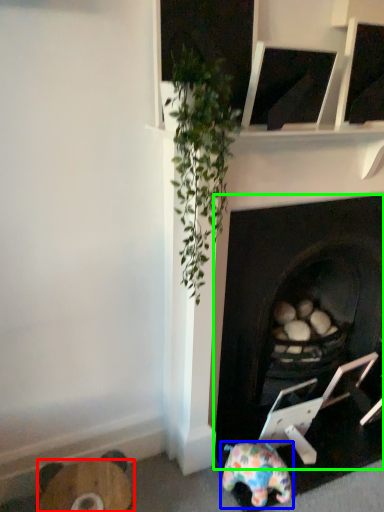
Question: Considering the real-world distances, which object is farthest from furniture (highlighted by a red box)? toy (highlighted by a blue box) or fireplace (highlighted by a green box)?

Choices:
 (A) toy
 (B) fireplace

Answer: (B)